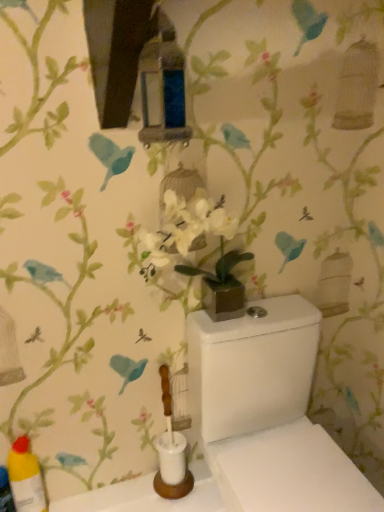
In order to face yellow plastic bottle at lower left, should I rotate leftwards or rightwards?

Rotate left and turn 21.295 degrees.

Where is `yellow plastic bottle at lower left`? yellow plastic bottle at lower left is located at coordinates (26, 478).

What do you see at coordinates (26, 478) in the screenshot?
I see `yellow plastic bottle at lower left` at bounding box center [26, 478].

Locate an element on the screen. white glossy toilet at center is located at coordinates (268, 412).

This screenshot has width=384, height=512. What do you see at coordinates (268, 412) in the screenshot? I see `white glossy toilet at center` at bounding box center [268, 412].

In order to face white glossy toilet at center, should I rotate leftwards or rightwards?

To face it directly, rotate right by 13.361 degrees.

Find the location of a particular element. Image resolution: width=384 pixels, height=512 pixels. yellow plastic bottle at lower left is located at coordinates (26, 478).

Can you confirm if white glossy toilet at center is positioned to the left of yellow plastic bottle at lower left?

No, white glossy toilet at center is not to the left of yellow plastic bottle at lower left.

Which is in front, white glossy toilet at center or yellow plastic bottle at lower left?

white glossy toilet at center is more forward.

Between point (291, 412) and point (19, 450), which one is positioned behind?

The point (291, 412) is more distant.

From the image's perspective, is white glossy toilet at center above yellow plastic bottle at lower left?

Yes, from the image's perspective, white glossy toilet at center is above yellow plastic bottle at lower left.

In the scene shown: From a real-world perspective, between white glossy toilet at center and yellow plastic bottle at lower left, who is vertically higher?

From a 3D spatial view, white glossy toilet at center is above.

Does white glossy toilet at center have a greater width compared to yellow plastic bottle at lower left?

Yes, white glossy toilet at center is wider than yellow plastic bottle at lower left.

Between white glossy toilet at center and yellow plastic bottle at lower left, which one has more height?

With more height is white glossy toilet at center.

Between white glossy toilet at center and yellow plastic bottle at lower left, which one has larger size?

white glossy toilet at center is bigger.

Is yellow plastic bottle at lower left located within white glossy toilet at center?

No, yellow plastic bottle at lower left is not inside white glossy toilet at center.

Is white glossy toilet at center positioned far away from yellow plastic bottle at lower left?

That's not correct — white glossy toilet at center is a little close to yellow plastic bottle at lower left.

Could you tell me if white glossy toilet at center is facing yellow plastic bottle at lower left?

No, white glossy toilet at center is not turned towards yellow plastic bottle at lower left.

What's the angular difference between white glossy toilet at center and yellow plastic bottle at lower left's facing directions?

They differ by 0.00138 degrees in their facing directions.

Measure the distance from white glossy toilet at center to yellow plastic bottle at lower left.

white glossy toilet at center is 26.45 inches from yellow plastic bottle at lower left.

Where is `toilet located in front of the yellow plastic bottle at lower left`? toilet located in front of the yellow plastic bottle at lower left is located at coordinates (268, 412).

Looking at this image, which object is positioned more to the left, yellow plastic bottle at lower left or white glossy toilet at center?

From the viewer's perspective, yellow plastic bottle at lower left appears more on the left side.

Between yellow plastic bottle at lower left and white glossy toilet at center, which one is positioned in front?

white glossy toilet at center.

Considering the positions of points (39, 481) and (242, 452), is point (39, 481) closer to camera compared to point (242, 452)?

No, it is not.

From the image's perspective, relative to white glossy toilet at center, is yellow plastic bottle at lower left above or below?

From the image's perspective, yellow plastic bottle at lower left appears below white glossy toilet at center.

From a real-world perspective, is yellow plastic bottle at lower left positioned over white glossy toilet at center based on gravity?

No, from a real-world perspective, yellow plastic bottle at lower left is not over white glossy toilet at center

Which of these two, yellow plastic bottle at lower left or white glossy toilet at center, is thinner?

Thinner between the two is yellow plastic bottle at lower left.

Can you confirm if yellow plastic bottle at lower left is taller than white glossy toilet at center?

Incorrect, the height of yellow plastic bottle at lower left is not larger of that of white glossy toilet at center.

Considering the relative sizes of yellow plastic bottle at lower left and white glossy toilet at center in the image provided, is yellow plastic bottle at lower left smaller than white glossy toilet at center?

Correct, yellow plastic bottle at lower left occupies less space than white glossy toilet at center.

Is yellow plastic bottle at lower left not inside white glossy toilet at center?

yellow plastic bottle at lower left is positioned outside white glossy toilet at center.

Is yellow plastic bottle at lower left positioned far away from white glossy toilet at center?

yellow plastic bottle at lower left is actually quite close to white glossy toilet at center.

Is yellow plastic bottle at lower left positioned with its back to white glossy toilet at center?

No, yellow plastic bottle at lower left's orientation is not away from white glossy toilet at center.

This screenshot has height=512, width=384. I want to click on bottle on the left of white glossy toilet at center, so click(26, 478).

Locate an element on the screen. This screenshot has width=384, height=512. bottle beneath the white glossy toilet at center (from a real-world perspective) is located at coordinates (26, 478).

The width and height of the screenshot is (384, 512). What are the coordinates of `toilet in front of the yellow plastic bottle at lower left` in the screenshot? It's located at (268, 412).